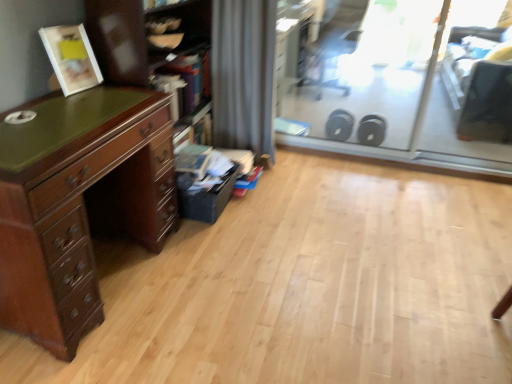
Question: From a real-world perspective, is transparent glass screen door at upper right, the first screen door positioned from the left, physically located above or below wooden bookshelf at left?

Choices:
 (A) below
 (B) above

Answer: (B)

Question: In terms of height, does transparent glass screen door at upper right, the first screen door positioned from the left, look taller or shorter compared to wooden bookshelf at left?

Choices:
 (A) short
 (B) tall

Answer: (A)

Question: Which object is positioned closest to the black plastic swivel chair at upper right?

Choices:
 (A) wooden bookshelf at left
 (B) transparent glass screen door at upper right, the first screen door positioned from the left
 (C) gray fabric curtain at center
 (D) transparent plastic screen door at upper right, acting as the 1th screen door starting from the right
 (E) mahogany wood chest of drawers at left

Answer: (B)

Question: Which object is positioned farthest from the transparent plastic screen door at upper right, acting as the 1th screen door starting from the right?

Choices:
 (A) matte white picture frame at upper left
 (B) black plastic swivel chair at upper right
 (C) transparent glass screen door at upper right, the second screen door when ordered from right to left
 (D) wooden bookshelf at left
 (E) mahogany wood chest of drawers at left

Answer: (A)